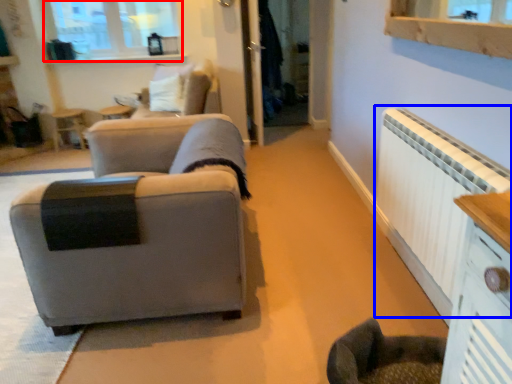
Question: Which point is further to the camera, window (highlighted by a red box) or radiator (highlighted by a blue box)?

Choices:
 (A) window
 (B) radiator

Answer: (A)